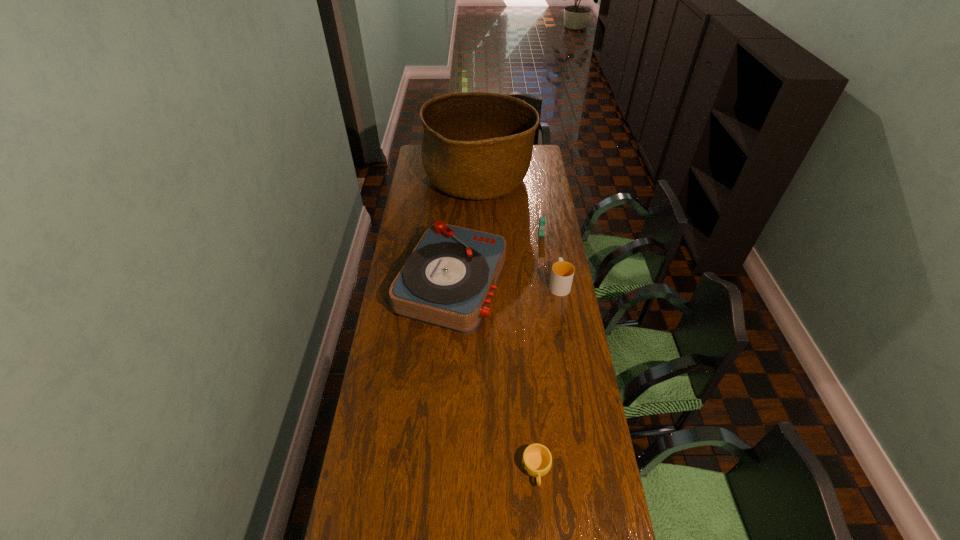
Where is `vacant space located 0.310m on the keypad of the fourth nearest object`? This screenshot has height=540, width=960. vacant space located 0.310m on the keypad of the fourth nearest object is located at coordinates tap(548, 286).

At what (x,y) coordinates should I click in order to perform the action: click on vacant space positioned 0.380m with the handle on the side of the farther cup. Please return your answer as a coordinate pair (x, y). The image size is (960, 540). Looking at the image, I should click on (547, 217).

Locate an element on the screen. The image size is (960, 540). vacant space located with the handle on the side of the farther cup is located at coordinates (547, 214).

Image resolution: width=960 pixels, height=540 pixels. Find the location of `free location located with the handle on the side of the farther cup`. free location located with the handle on the side of the farther cup is located at coordinates click(551, 235).

Find the location of a particular element. This screenshot has height=540, width=960. free space located 0.300m on the left of the nearer cup is located at coordinates (420, 469).

I want to click on object that is at the far edge, so click(476, 145).

Locate an element on the screen. This screenshot has height=540, width=960. basket that is positioned at the left edge is located at coordinates (476, 145).

This screenshot has height=540, width=960. Find the location of `record player that is positioned at the left edge`. record player that is positioned at the left edge is located at coordinates (447, 281).

Find the location of a particular element. The width and height of the screenshot is (960, 540). basket that is at the right edge is located at coordinates (476, 145).

This screenshot has width=960, height=540. I want to click on cellular telephone that is at the right edge, so click(542, 221).